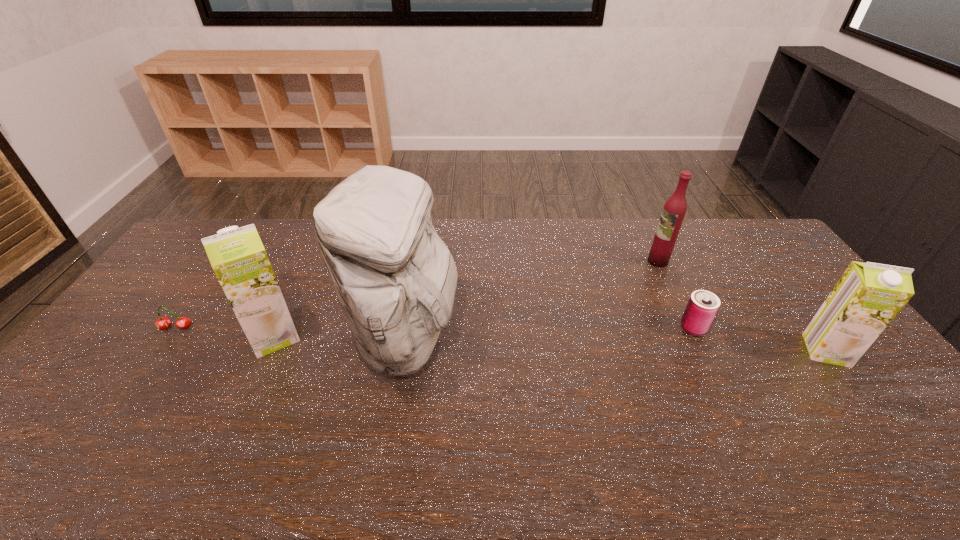
At what (x,y) coordinates should I click in order to perform the action: click on vacant space that satisfies the following two spatial constraints: 1. on the label of the liquor; 2. on the left side of the can. Please return your answer as a coordinate pair (x, y). The image size is (960, 540). Looking at the image, I should click on (689, 327).

Where is `vacant area that satisfies the following two spatial constraints: 1. with stems pointing upwards on the shortest object; 2. on the left side of the left soya milk`? This screenshot has height=540, width=960. vacant area that satisfies the following two spatial constraints: 1. with stems pointing upwards on the shortest object; 2. on the left side of the left soya milk is located at coordinates (171, 336).

At what (x,y) coordinates should I click in order to perform the action: click on vacant space that satisfies the following two spatial constraints: 1. with stems pointing upwards on the leftmost object; 2. on the right side of the second object from left to right. Please return your answer as a coordinate pair (x, y). Image resolution: width=960 pixels, height=540 pixels. Looking at the image, I should click on (171, 336).

Locate an element on the screen. vacant space that satisfies the following two spatial constraints: 1. on the label of the farthest object; 2. with stems pointing upwards on the shortest object is located at coordinates (690, 328).